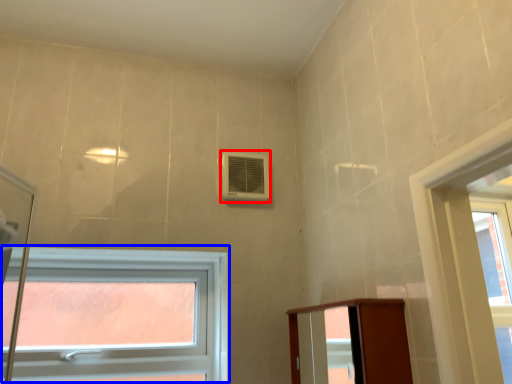
Question: Which object appears farthest to the camera in this image, air conditioning (highlighted by a red box) or window (highlighted by a blue box)?

Choices:
 (A) air conditioning
 (B) window

Answer: (A)